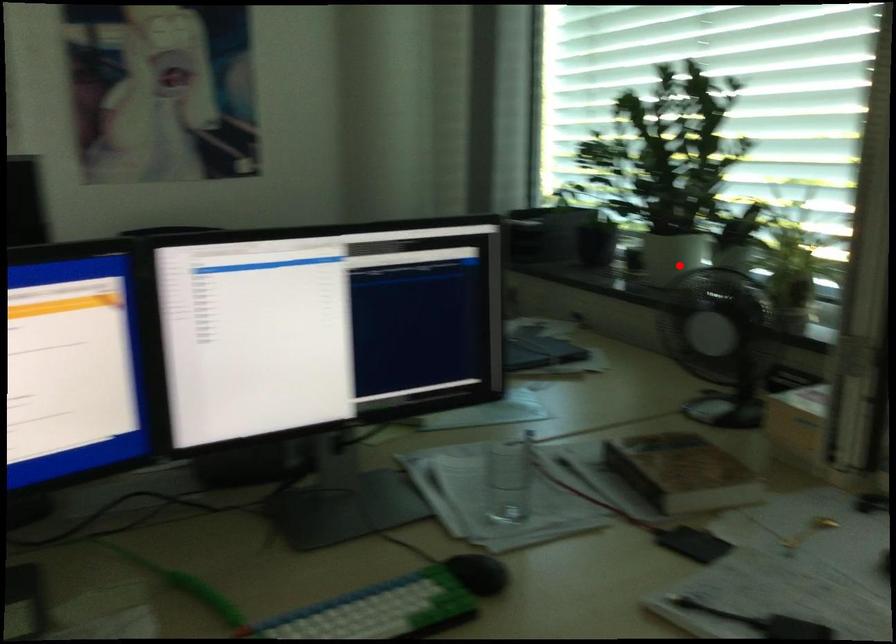
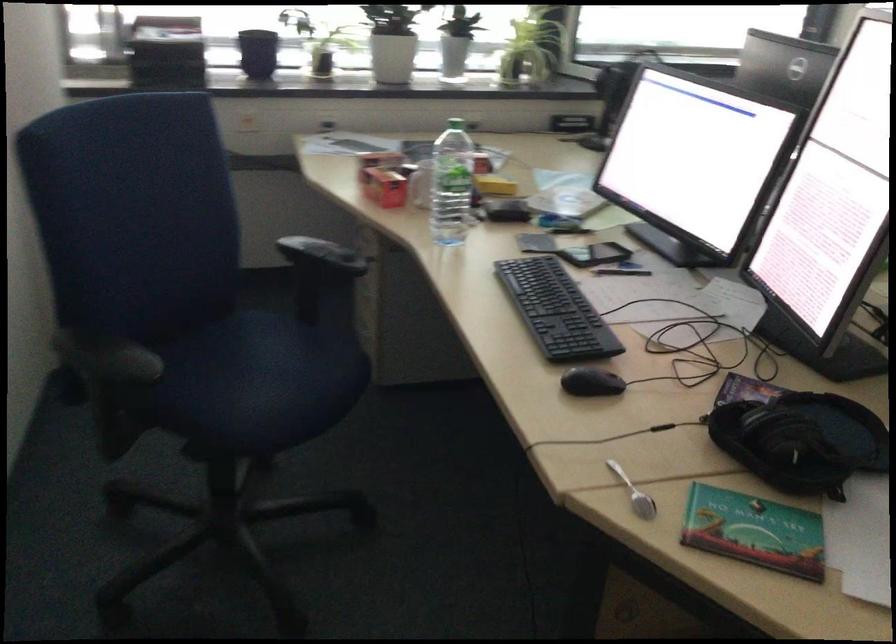
Where in the second image is the point corresponding to the highlighted location from the first image?

(392, 58)